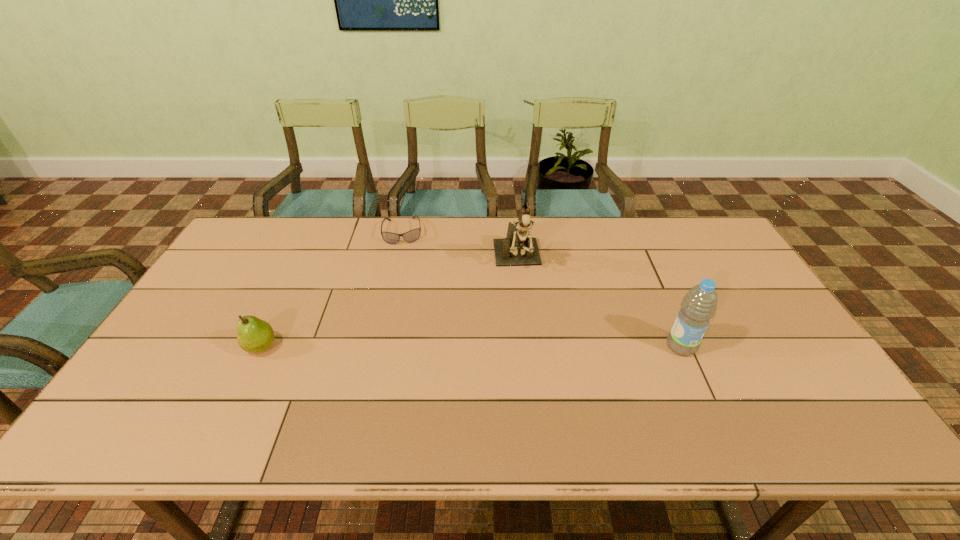
The image size is (960, 540). Identify the location of vacant space at the left edge of the desktop. coord(247,271).

Find the location of a particular element. This screenshot has width=960, height=540. vacant space at the right edge is located at coordinates (747, 311).

Identify the location of vacant space at the far left corner of the desktop. Image resolution: width=960 pixels, height=540 pixels. (281, 219).

Where is `vacant space at the far right corner`? vacant space at the far right corner is located at coordinates (672, 228).

In the image, there is a desktop. Find the location of `vacant space at the near right corner`. vacant space at the near right corner is located at coordinates (771, 388).

The height and width of the screenshot is (540, 960). Find the location of `free space between the second object from right to left and the third object from right to left`. free space between the second object from right to left and the third object from right to left is located at coordinates (460, 246).

Locate an element on the screen. The height and width of the screenshot is (540, 960). free point between the shortest object and the figurine is located at coordinates (460, 246).

Identify the location of blank region between the pear and the rightmost object. The image size is (960, 540). (471, 347).

The image size is (960, 540). I want to click on free spot between the water bottle and the figurine, so click(599, 303).

The image size is (960, 540). Find the location of `free point between the shortest object and the leftmost object`. free point between the shortest object and the leftmost object is located at coordinates (332, 289).